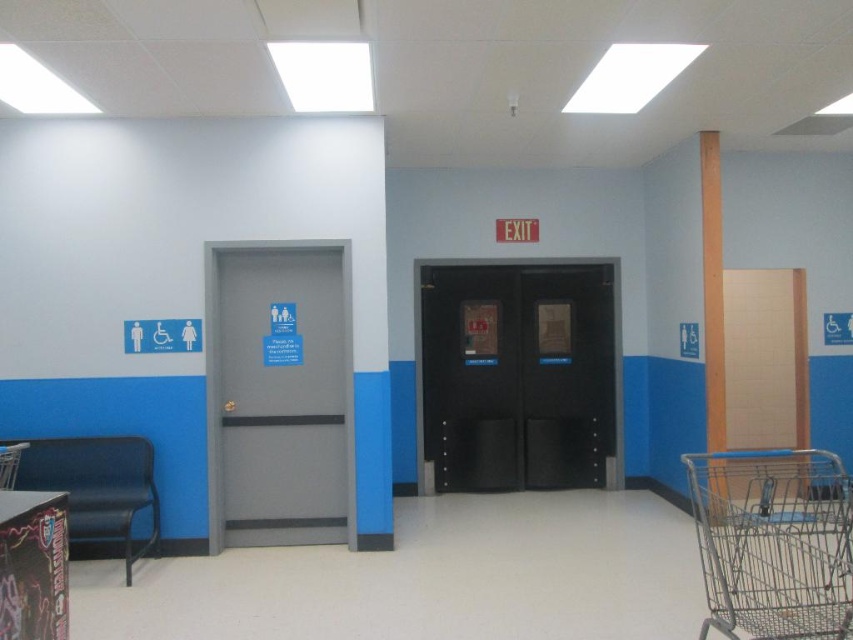
Between metallic blue bench at left and gray matte door at left, which one appears on the left side from the viewer's perspective?

Positioned to the left is metallic blue bench at left.

Looking at this image, can you confirm if metallic blue bench at left is positioned to the right of gray matte door at left?

In fact, metallic blue bench at left is to the left of gray matte door at left.

Who is more distant from viewer, [68,464] or [218,332]?

The point [218,332] is behind.

Image resolution: width=853 pixels, height=640 pixels. In order to click on metallic blue bench at left in this screenshot , I will do `click(97, 486)`.

Can you confirm if black metal elevator at center is positioned to the right of wooden pillar at right?

In fact, black metal elevator at center is to the left of wooden pillar at right.

Which is above, black metal elevator at center or wooden pillar at right?

wooden pillar at right is above.

The height and width of the screenshot is (640, 853). What do you see at coordinates (520, 360) in the screenshot? I see `black metal elevator at center` at bounding box center [520, 360].

You are a GUI agent. You are given a task and a screenshot of the screen. Output one action in this format:
    pyautogui.click(x=<x>, y=<y>)
    Task: Click on the black metal elevator at center
    The height and width of the screenshot is (640, 853).
    Given the screenshot: What is the action you would take?
    pyautogui.click(x=520, y=360)

Can you confirm if gray matte door at left is wider than metallic blue chair at lower left?

Yes.

Between point (216, 456) and point (13, 474), which one is positioned behind?

The point (216, 456) is behind.

I want to click on gray matte door at left, so click(219, 372).